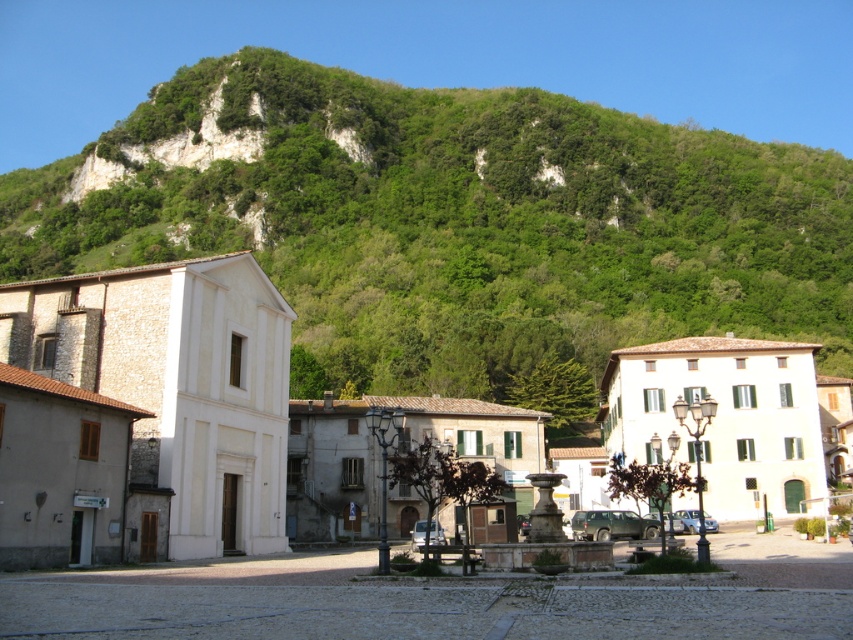
Which of these two, green leafy hillside at upper center or white stone building at center, stands shorter?

Standing shorter between the two is white stone building at center.

Based on the photo, is green leafy hillside at upper center bigger than white stone building at center?

Yes.

Does point (218, 216) lie in front of point (271, 330)?

No, it is not.

Identify the location of green leafy hillside at upper center. The height and width of the screenshot is (640, 853). (461, 224).